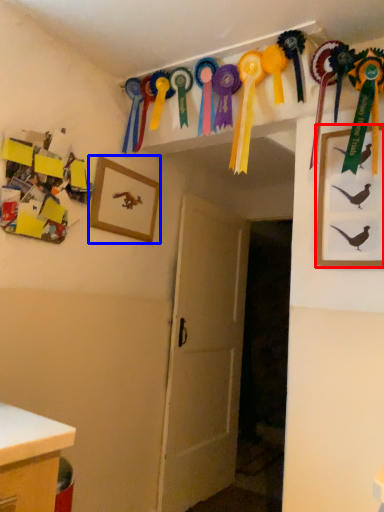
Question: Which of the following is the closest to the observer, picture frame (highlighted by a red box) or picture frame (highlighted by a blue box)?

Choices:
 (A) picture frame
 (B) picture frame

Answer: (A)